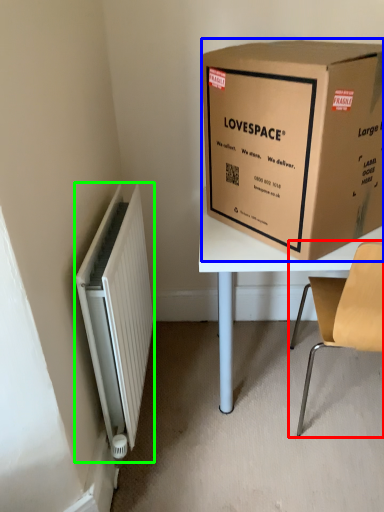
Question: Considering the real-world distances, which object is farthest from chair (highlighted by a red box)? box (highlighted by a blue box) or radiator (highlighted by a green box)?

Choices:
 (A) box
 (B) radiator

Answer: (B)